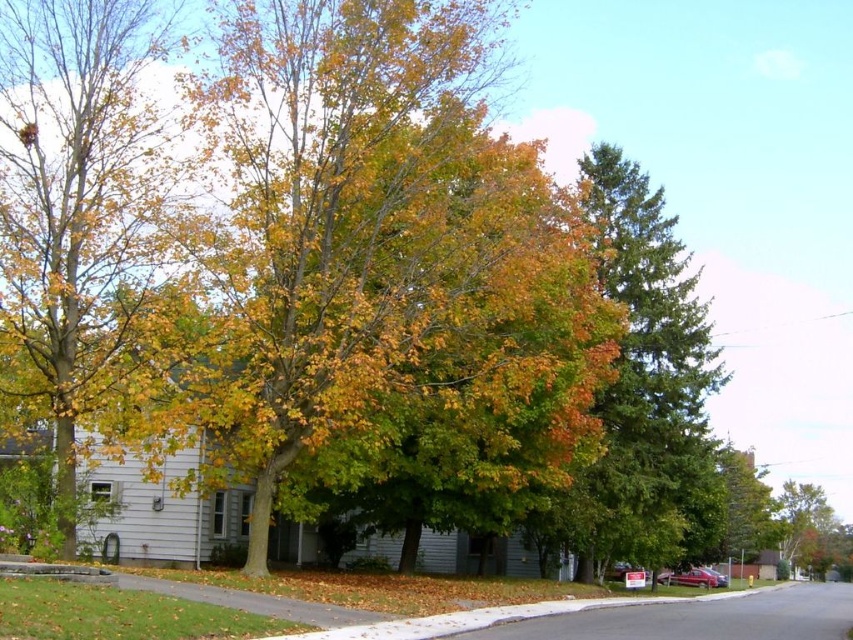
Who is positioned more to the left, green textured pine tree at center or green leafy tree at lower right?

green textured pine tree at center is more to the left.

Which is above, green textured pine tree at center or green leafy tree at lower right?

green textured pine tree at center

This screenshot has width=853, height=640. I want to click on green textured pine tree at center, so click(x=643, y=392).

Who is shorter, yellow-green foliage at left or green leafy tree at lower right?

Standing shorter between the two is green leafy tree at lower right.

Can you confirm if yellow-green foliage at left is smaller than green leafy tree at lower right?

Incorrect, yellow-green foliage at left is not smaller in size than green leafy tree at lower right.

Is point (67, 412) closer to camera compared to point (842, 556)?

Yes, point (67, 412) is in front of point (842, 556).

Locate an element on the screen. Image resolution: width=853 pixels, height=640 pixels. yellow-green foliage at left is located at coordinates (80, 209).

Does green textured tree at center come behind green leafy tree at lower right?

That is False.

Between green textured tree at center and green leafy tree at lower right, which one appears on the left side from the viewer's perspective?

green textured tree at center

Which is in front, point (735, 484) or point (817, 499)?

Point (735, 484) is more forward.

What are the coordinates of `green textured tree at center` in the screenshot? It's located at (746, 508).